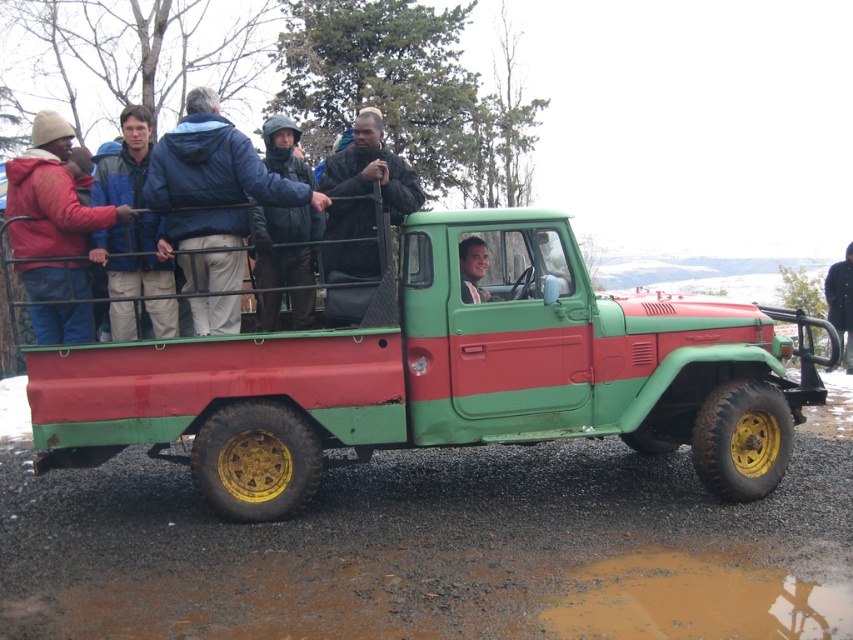
You are a delivery person who needs to load a package onto the green matte truck at center. The package is 2 meters tall. Can you place it on top of the truck without it touching the dark brown leather jacket at center?

The green matte truck at center is taller than the dark brown leather jacket at center. Since the package is 2 meters tall, it can be placed on top of the truck without touching the jacket as long as the truck itself is tall enough to support the package height. However, the exact height of the truck isn

You are standing at the point closest to the pickup truck and want to walk towards the distant mountains. Which point should you step on first, point (213,198) or point (151,292)?

Point (213,198) is in front of point (151,292), so you should step on point (213,198) first to move towards the distant mountains.